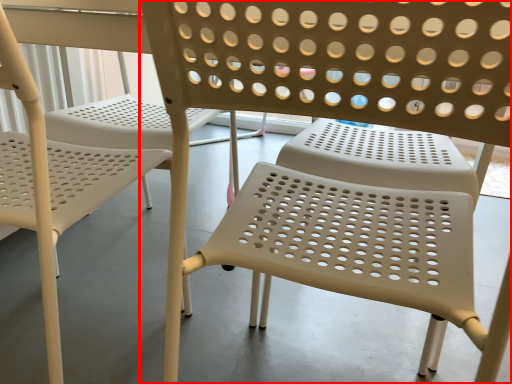
Question: From the image's perspective, what is the correct spatial relationship of chair (annotated by the red box) in relation to chair?

Choices:
 (A) below
 (B) above

Answer: (A)